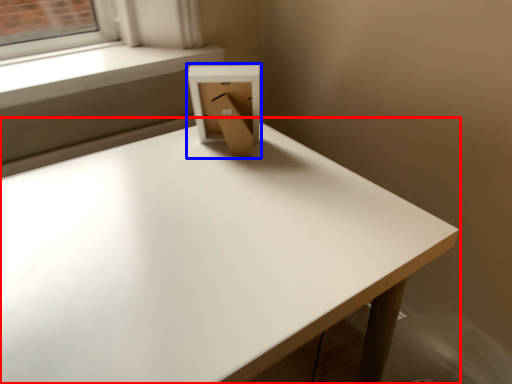
Question: Which object is closer to the camera taking this photo, table (highlighted by a red box) or cardboard box (highlighted by a blue box)?

Choices:
 (A) table
 (B) cardboard box

Answer: (A)